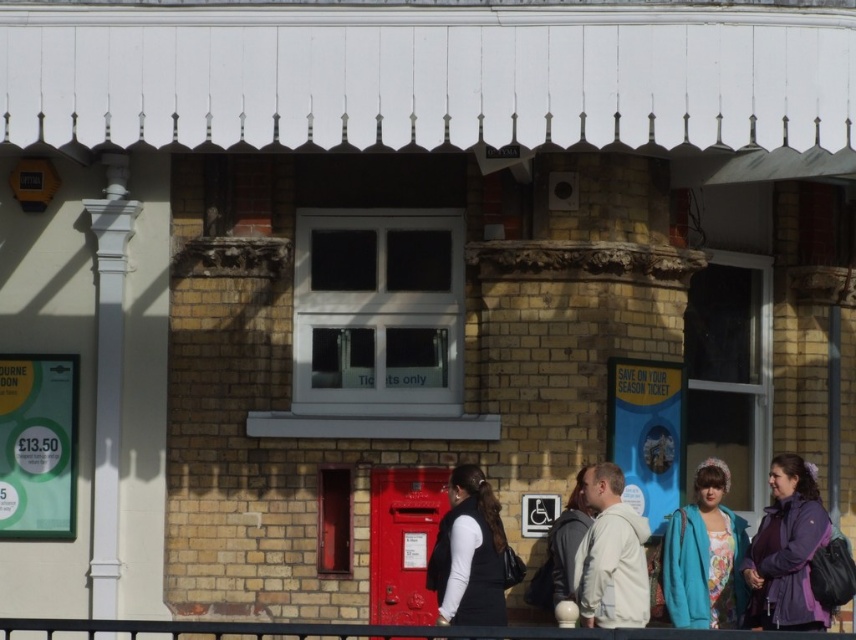
Which is more to the right, purple fleece jacket at lower right or black matte vest at center?

Positioned to the right is purple fleece jacket at lower right.

Between purple fleece jacket at lower right and black matte vest at center, which one has more height?

purple fleece jacket at lower right

This screenshot has height=640, width=856. What are the coordinates of `purple fleece jacket at lower right` in the screenshot? It's located at (786, 552).

Between metallic red rail at lower center and white fleece jacket at center, which one is positioned higher?

white fleece jacket at center

Who is shorter, metallic red rail at lower center or white fleece jacket at center?

Standing shorter between the two is metallic red rail at lower center.

Looking at this image, who is more forward, [423,630] or [592,532]?

Point [423,630] is more forward.

Locate an element on the screen. metallic red rail at lower center is located at coordinates (360, 630).

Where is `white glossy column at left`? Image resolution: width=856 pixels, height=640 pixels. white glossy column at left is located at coordinates (108, 376).

Who is lower down, white glossy column at left or gray hoodie at center?

gray hoodie at center

Which is behind, point (111, 484) or point (563, 598)?

The point (111, 484) is behind.

Identify the location of white glossy column at left. The height and width of the screenshot is (640, 856). (108, 376).